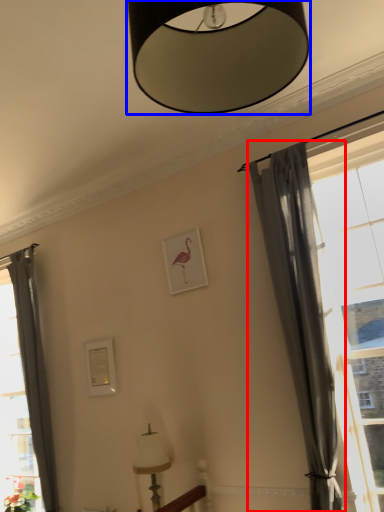
Question: Which object is further to the camera taking this photo, curtain (highlighted by a red box) or lamp (highlighted by a blue box)?

Choices:
 (A) curtain
 (B) lamp

Answer: (A)